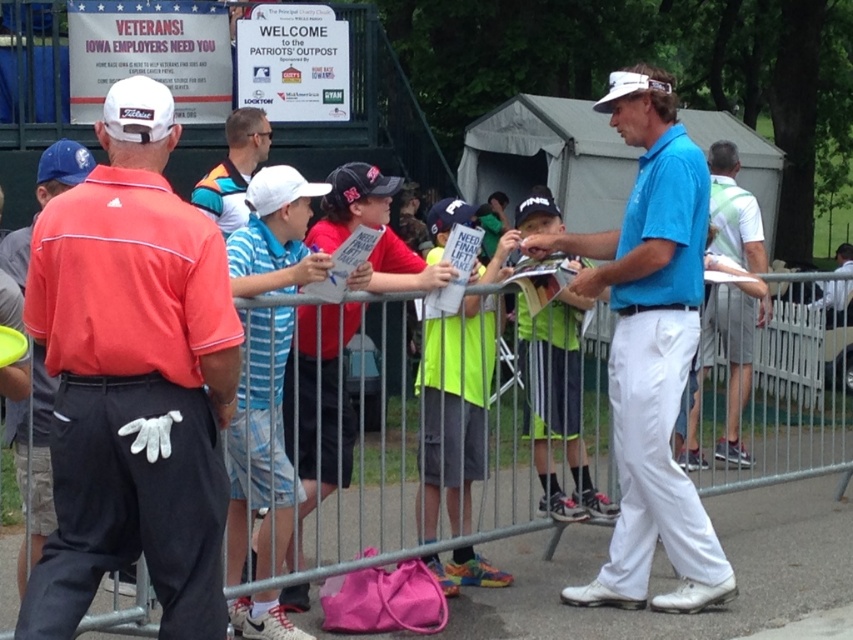
You are a photographer standing at the edge of the metal barricade. You want to take a photo of the orange shirt at center without the metal at center blocking the view. Is it possible? Please explain.

The metal at center and orange shirt at center are 3.98 meters apart. Since the photographer is at the edge of the metal barricade, they can move sideways or adjust their angle to capture the orange shirt at center without obstruction, as there is sufficient distance between the two objects.